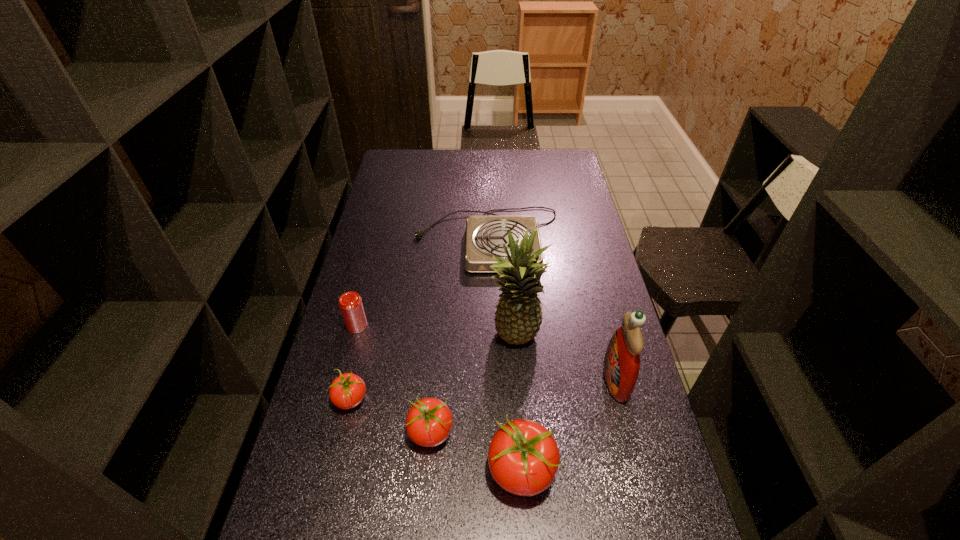
This screenshot has height=540, width=960. What are the coordinates of `free space between the second shortest tomato and the hotplate` in the screenshot? It's located at (460, 337).

At what (x,y) coordinates should I click in order to perform the action: click on free space between the second tallest object and the second tomato from left to right. Please return your answer as a coordinate pair (x, y). Looking at the image, I should click on (523, 407).

You are a GUI agent. You are given a task and a screenshot of the screen. Output one action in this format:
    pyautogui.click(x=<x>, y=<y>)
    Task: Click on the free space between the sixth tallest object and the tallest object
    The height and width of the screenshot is (540, 960).
    Given the screenshot: What is the action you would take?
    pyautogui.click(x=433, y=368)

Find the location of a particular element. The width and height of the screenshot is (960, 540). empty location between the tallest tomato and the beer can is located at coordinates (440, 399).

Where is `empty space that is in between the rightmost object and the farthest object`? empty space that is in between the rightmost object and the farthest object is located at coordinates (552, 310).

Locate an element on the screen. The image size is (960, 540). blank region between the second shortest tomato and the beer can is located at coordinates (394, 380).

Locate an element on the screen. unoccupied area between the detergent and the fifth shortest object is located at coordinates (568, 426).

Where is `blank region between the leftmost tomato and the beer can`? The image size is (960, 540). blank region between the leftmost tomato and the beer can is located at coordinates (354, 362).

At what (x,y) coordinates should I click in order to perform the action: click on the closest object to the pineapple. Please return your answer as a coordinate pair (x, y). The image size is (960, 540). Looking at the image, I should click on (621, 364).

You are a GUI agent. You are given a task and a screenshot of the screen. Output one action in this format:
    pyautogui.click(x=<x>, y=<y>)
    Task: Click on the object that is the closest one to the second tallest object
    
    Given the screenshot: What is the action you would take?
    pyautogui.click(x=518, y=317)